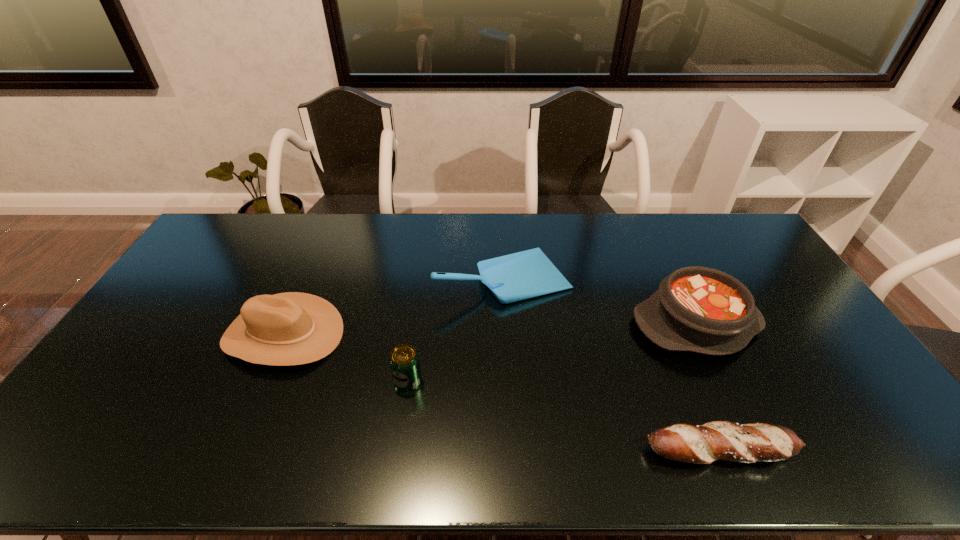
Find the location of a particular element. Image resolution: width=960 pixels, height=540 pixels. free space between the third object from right to left and the beer can is located at coordinates (456, 329).

Where is `free area in between the fourth object from right to left and the casserole`? This screenshot has height=540, width=960. free area in between the fourth object from right to left and the casserole is located at coordinates (552, 352).

In order to click on vacant area that lies between the dustpan and the beer can in this screenshot , I will do [456, 329].

Identify the location of vacant space that's between the baguet and the casserole. Image resolution: width=960 pixels, height=540 pixels. (708, 387).

Locate an element on the screen. The image size is (960, 540). vacant area between the baguet and the beer can is located at coordinates (564, 415).

This screenshot has width=960, height=540. Find the location of `free space between the cowboy hat and the casserole`. free space between the cowboy hat and the casserole is located at coordinates (490, 329).

Find the location of `vacant area that lies between the third object from left to right and the beer can`. vacant area that lies between the third object from left to right and the beer can is located at coordinates (456, 329).

The image size is (960, 540). What are the coordinates of `object that stands as the closest to the dustpan` in the screenshot? It's located at (699, 309).

Point out which object is positioned as the nearest to the casserole. Please provide its 2D coordinates. Your answer should be formatted as a tuple, i.e. [(x, y)], where the tuple contains the x and y coordinates of a point satisfying the conditions above.

[(526, 274)]

I want to click on vacant area in the image that satisfies the following two spatial constraints: 1. on the back side of the leftmost object; 2. on the left side of the casserole, so coord(288,323).